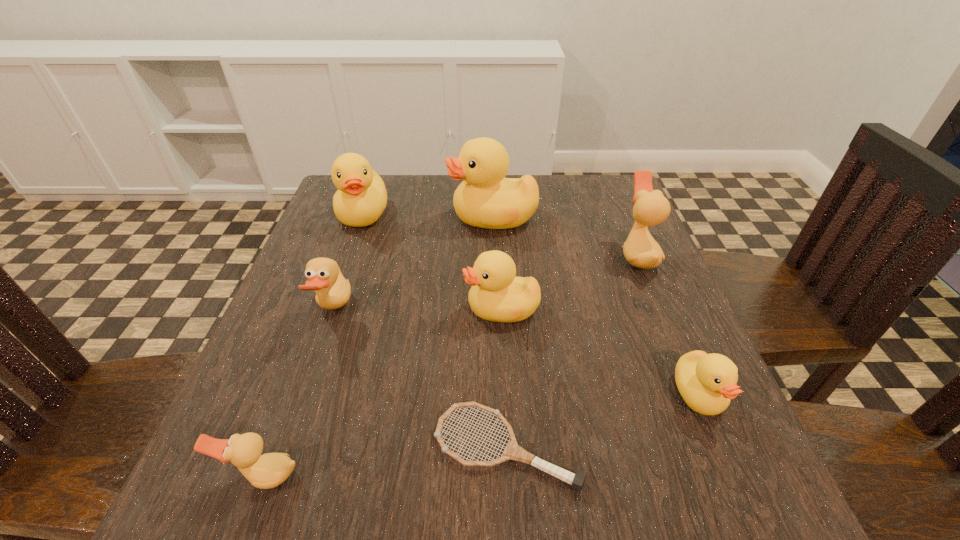
Where is `the smallest tan duck`? the smallest tan duck is located at coordinates (269, 470).

Find the location of a particular element. gray tennis racket is located at coordinates (513, 451).

Identify the location of tennis racket. (513, 451).

Find the location of a particular element. This screenshot has width=960, height=540. free location located at the beak of the tallest duck is located at coordinates [404, 217].

The height and width of the screenshot is (540, 960). What are the coordinates of `free region located 0.060m at the beak of the tallest duck` in the screenshot? It's located at (424, 217).

Identify the location of vacant space situated 0.100m at the beak of the tallest duck. (408, 217).

At what (x,y) coordinates should I click in order to perform the action: click on vacant region located at the beak of the leftmost yellow duck. Please return your answer as a coordinate pair (x, y). Looking at the image, I should click on (350, 249).

In order to click on vacant area situated on the beak of the farthest tan duck in this screenshot , I will do `click(564, 256)`.

Identify the location of free region located 0.050m on the beak of the farthest tan duck. (596, 256).

Locate an element on the screen. Image resolution: width=960 pixels, height=540 pixels. vacant region located on the beak of the farthest tan duck is located at coordinates (537, 256).